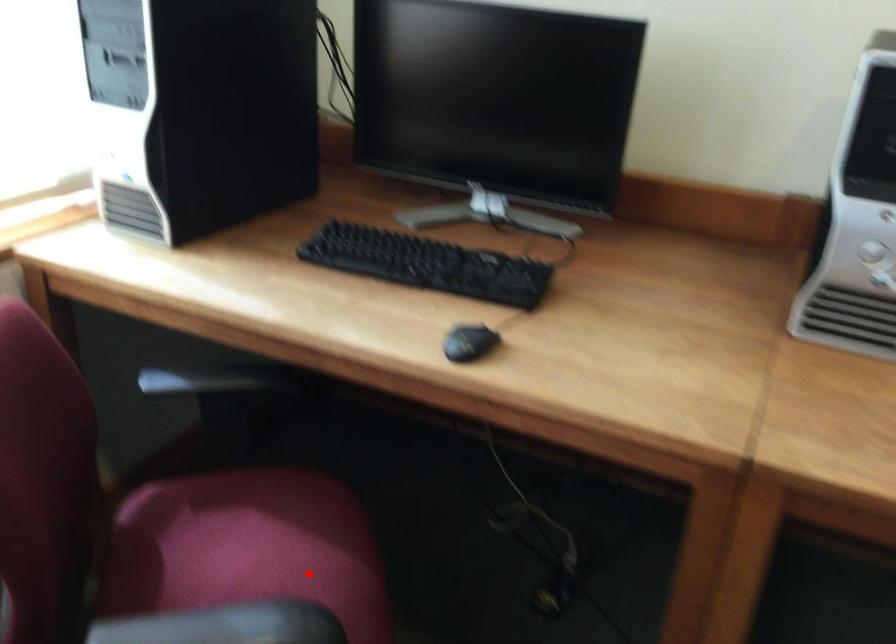
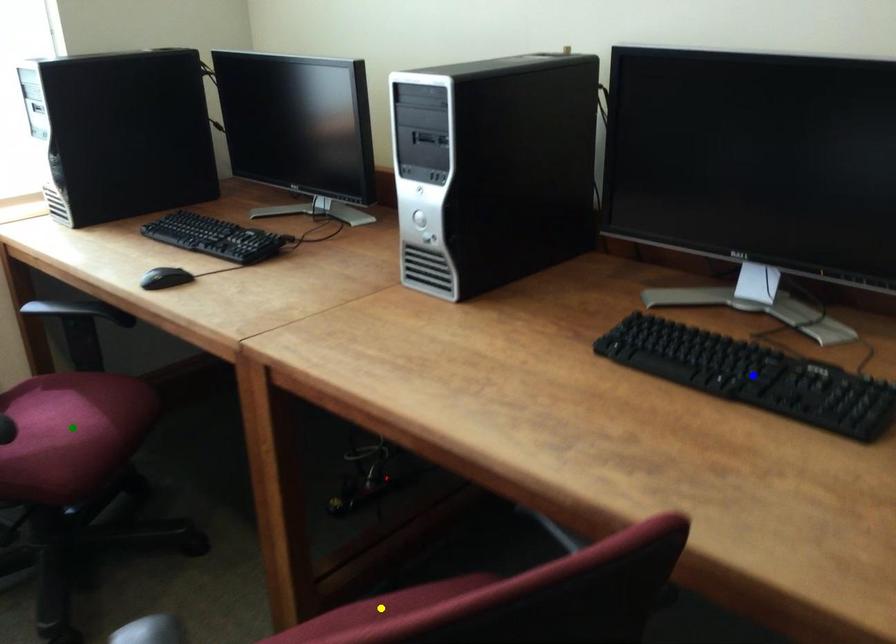
Question: I am providing you with two images of the same scene from different viewpoints. A red point is marked on the first image. You are given multiple points on the second image. Which spot in image 2 lines up with the point in image 1?

Choices:
 (A) yellow point
 (B) green point
 (C) blue point

Answer: (B)